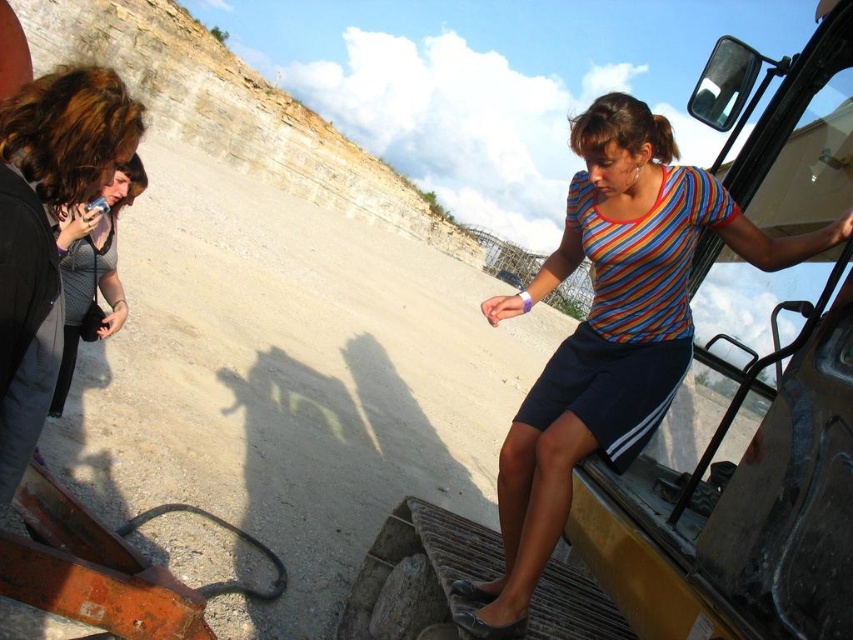
Question: Is the position of striped cotton shirt at upper right more distant than that of matte gray shirt at left?

Choices:
 (A) yes
 (B) no

Answer: (B)

Question: Is matte gray shirt at left positioned before gray textured shirt at left?

Choices:
 (A) no
 (B) yes

Answer: (B)

Question: Among these points, which one is farthest from the camera?

Choices:
 (A) (82, 260)
 (B) (733, 224)

Answer: (A)

Question: Among these objects, which one is farthest from the camera?

Choices:
 (A) striped cotton shirt at upper right
 (B) gray textured shirt at left

Answer: (B)

Question: Which point is farther from the camera taking this photo?

Choices:
 (A) (41, 252)
 (B) (109, 310)
 (C) (631, 198)

Answer: (B)

Question: Does striped cotton shirt at upper right appear under gray textured shirt at left?

Choices:
 (A) no
 (B) yes

Answer: (B)